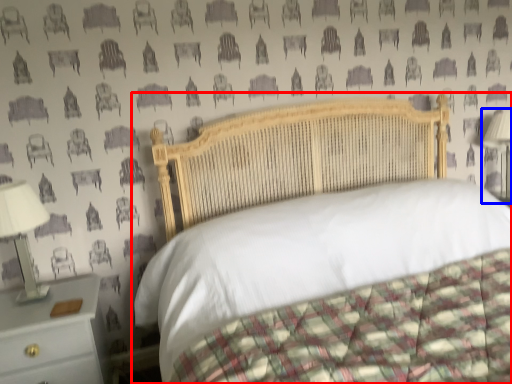
Question: Which point is closer to the camera, bed (highlighted by a red box) or bedside lamp (highlighted by a blue box)?

Choices:
 (A) bed
 (B) bedside lamp

Answer: (A)